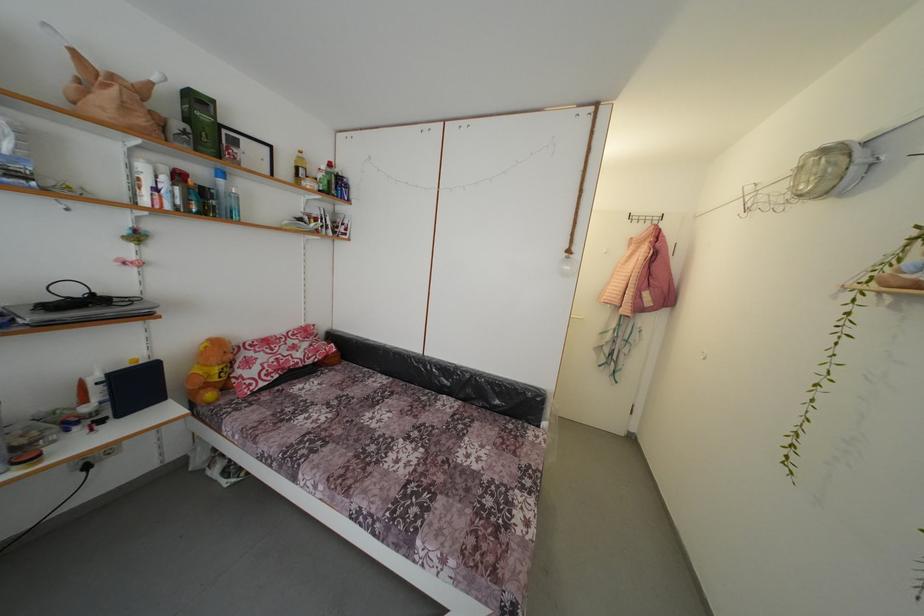
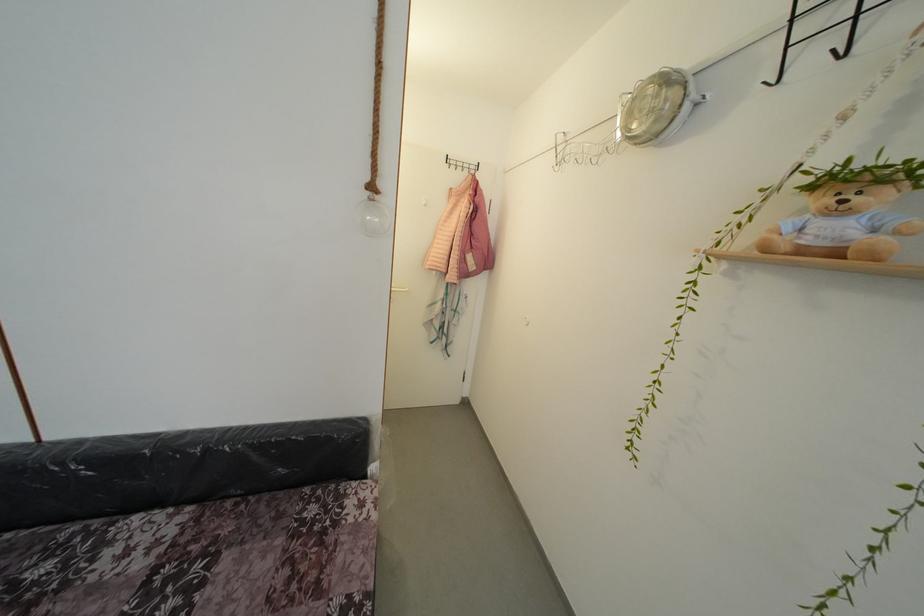
The point at (477,382) is marked in the first image. Where is the corresponding point in the second image?

(213, 456)